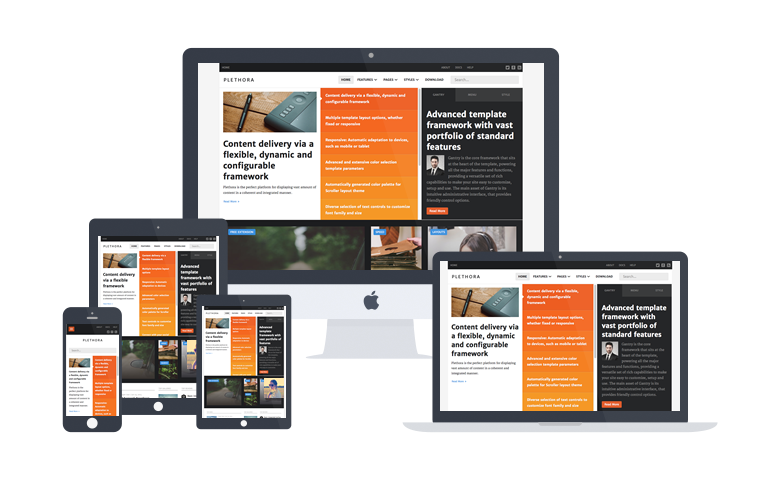
The height and width of the screenshot is (480, 780). I want to click on pen, so click(x=240, y=115), click(x=468, y=303), click(x=111, y=261), click(x=210, y=323), click(x=73, y=364).